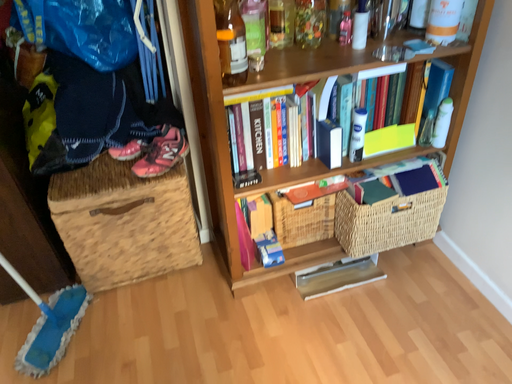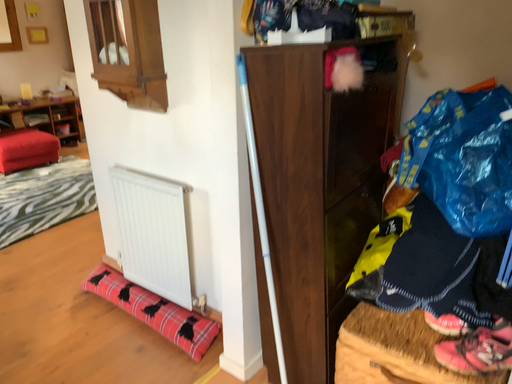
Question: Which way did the camera rotate in the video?

Choices:
 (A) rotated downward
 (B) rotated upward

Answer: (B)